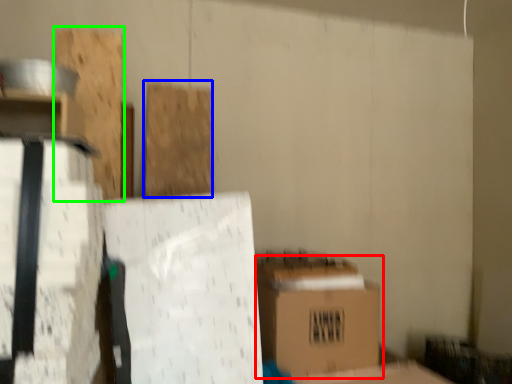
Question: Based on their relative distances, which object is farther from box (highlighted by a red box)? Choose from wood (highlighted by a blue box) and wood (highlighted by a green box).

Choices:
 (A) wood
 (B) wood

Answer: (B)